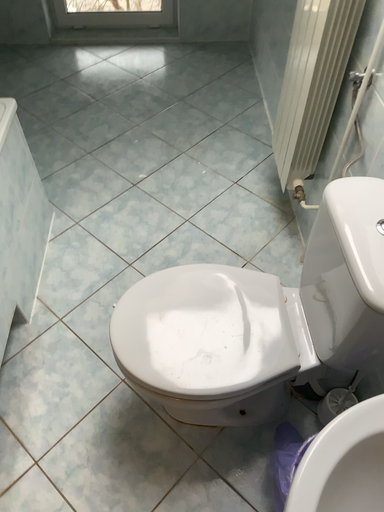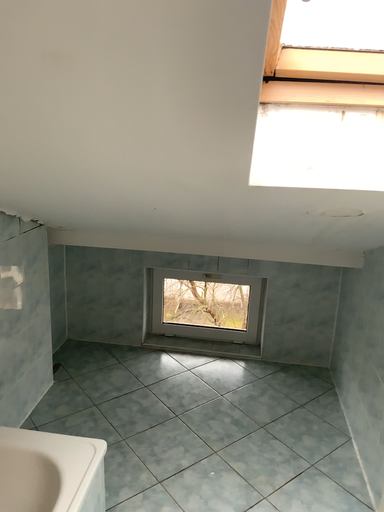
Question: How did the camera likely rotate when shooting the video?

Choices:
 (A) rotated downward
 (B) rotated upward

Answer: (B)